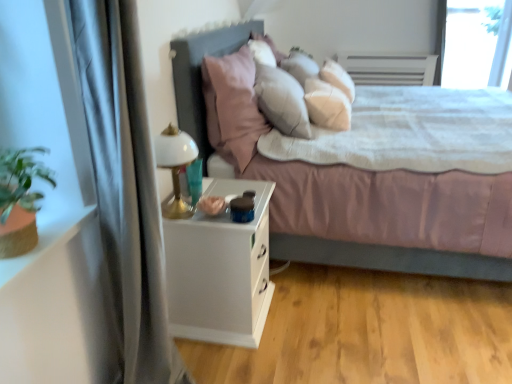
Find the location of a particular element. free spot to the right of white matte nightstand at lower left is located at coordinates click(x=310, y=313).